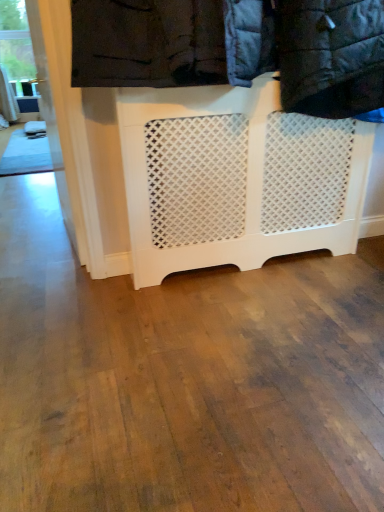
Question: In terms of width, does white lattice radiator at center look wider or thinner when compared to white lattice laundry at upper center?

Choices:
 (A) wide
 (B) thin

Answer: (B)

Question: Visually, is white lattice radiator at center positioned to the left or to the right of white lattice laundry at upper center?

Choices:
 (A) left
 (B) right

Answer: (A)

Question: Which is nearer to the white lattice laundry at upper center?

Choices:
 (A) white lattice radiator at center
 (B) clear glass window at upper left

Answer: (A)

Question: Estimate the real-world distances between objects in this image. Which object is closer to the clear glass window at upper left?

Choices:
 (A) white lattice laundry at upper center
 (B) white lattice radiator at center

Answer: (B)